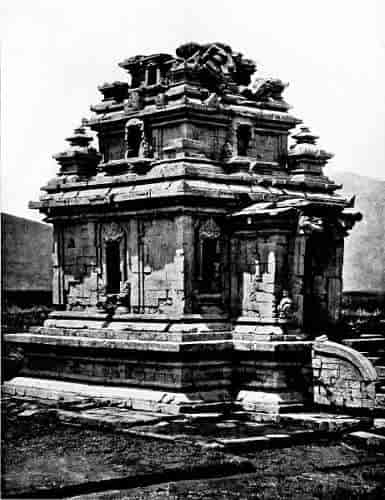
Image resolution: width=385 pixels, height=500 pixels. I want to click on pillar, so click(x=74, y=140).